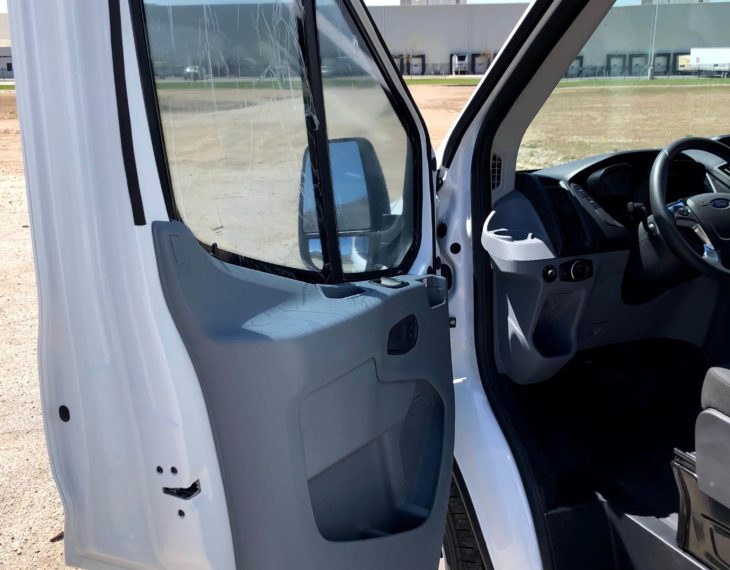
Identify the location of speaker. (415, 455).